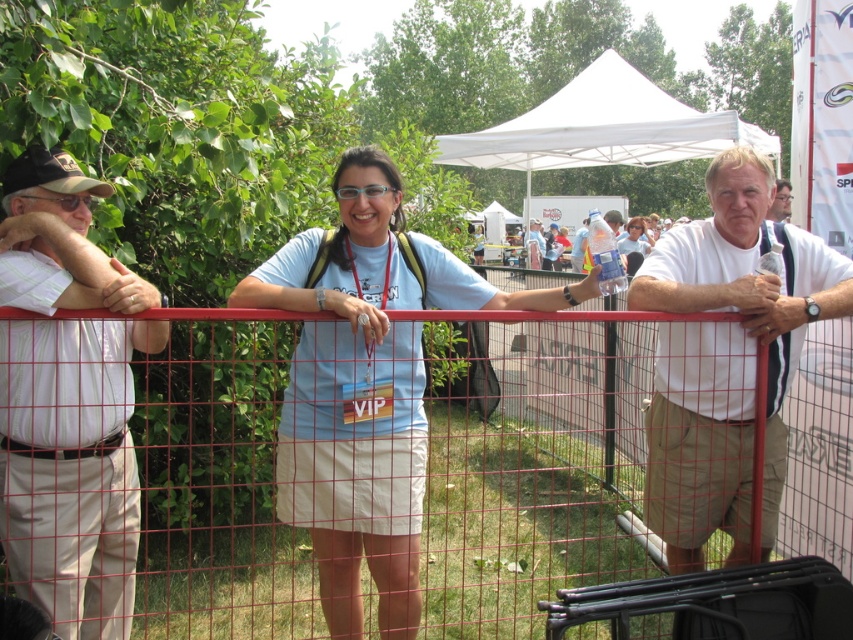
You are a photographer standing behind the camera at the event. You want to capture a photo that includes both the white cotton shirt at left and the matte blue shirt at center. Given that your camera has a maximum focus range of 30 feet, will you need to adjust your position to ensure both subjects are in focus?

The distance between the white cotton shirt at left and the matte blue shirt at center is 34.76 feet, which exceeds the camera maximum focus range of 30 feet. Therefore, you need to move closer to reduce the distance between the subjects to ensure both are in focus.

You are standing in a park and see two points marked in the scene. The first point is at coordinates point (138, 342) and the second is at point (639, 221). Which point is closer to you?

Point (138, 342) is closer to the viewer than point (639, 221).